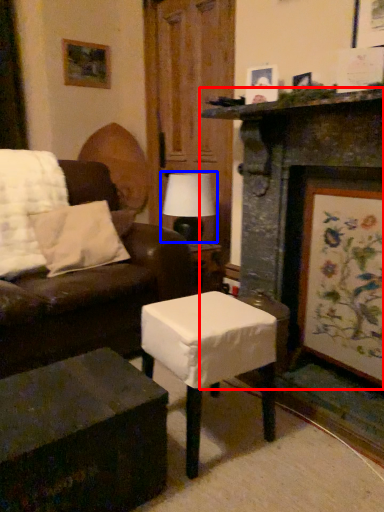
Question: Which point is further to the camera, fireplace (highlighted by a red box) or table lamp (highlighted by a blue box)?

Choices:
 (A) fireplace
 (B) table lamp

Answer: (B)